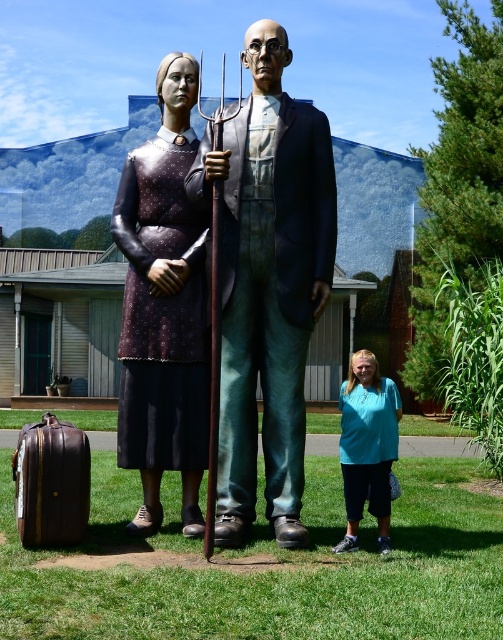
Question: Which point is farther to the camera?

Choices:
 (A) (62, 456)
 (B) (322, 301)
 (C) (342, 452)

Answer: (C)

Question: Does polished bronze statue at center appear over teal fabric shirt at lower right?

Choices:
 (A) no
 (B) yes

Answer: (B)

Question: Is polished bronze statue at center to the left of matte black dress at center from the viewer's perspective?

Choices:
 (A) yes
 (B) no

Answer: (B)

Question: Which point is closer to the camera?

Choices:
 (A) polished bronze statue at center
 (B) brown leather suitcase at lower left

Answer: (B)

Question: Considering the real-world distances, which object is farthest from the matte black dress at center?

Choices:
 (A) brown leather suitcase at lower left
 (B) teal fabric shirt at lower right
 (C) polished bronze statue at center

Answer: (C)

Question: Considering the relative positions of polished bronze statue at center and brown leather suitcase at lower left in the image provided, where is polished bronze statue at center located with respect to brown leather suitcase at lower left?

Choices:
 (A) below
 (B) above

Answer: (B)